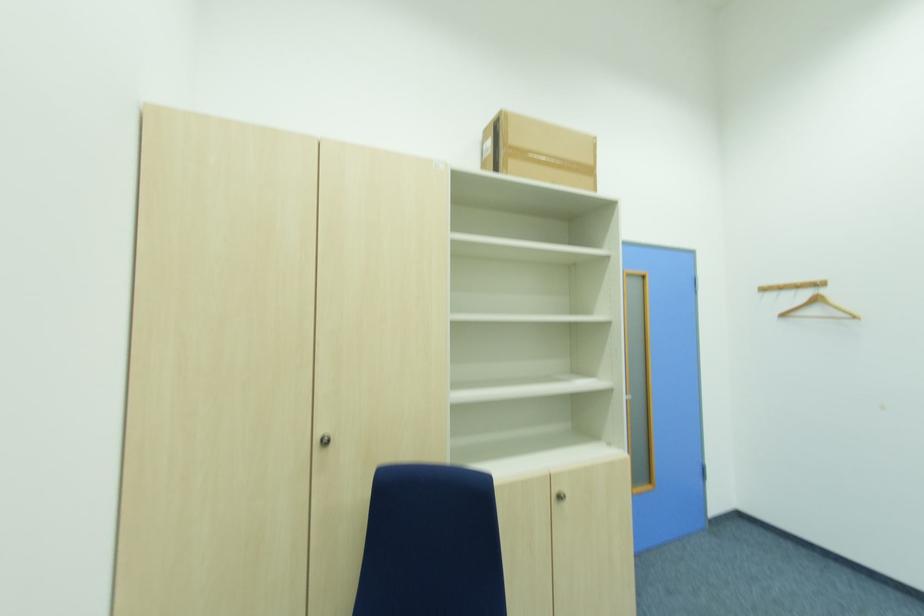
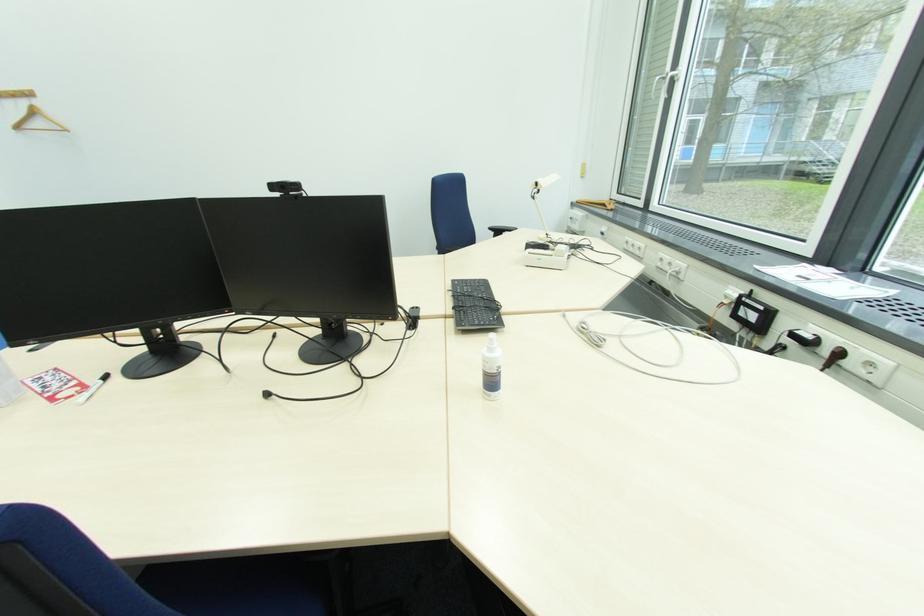
Find the pixel in the second image that matches the point at 809,296 in the first image.

(29, 105)